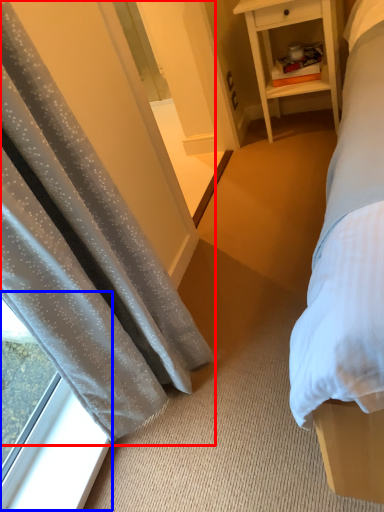
Question: Which object appears farthest to the camera in this image, curtain (highlighted by a red box) or window (highlighted by a blue box)?

Choices:
 (A) curtain
 (B) window

Answer: (B)